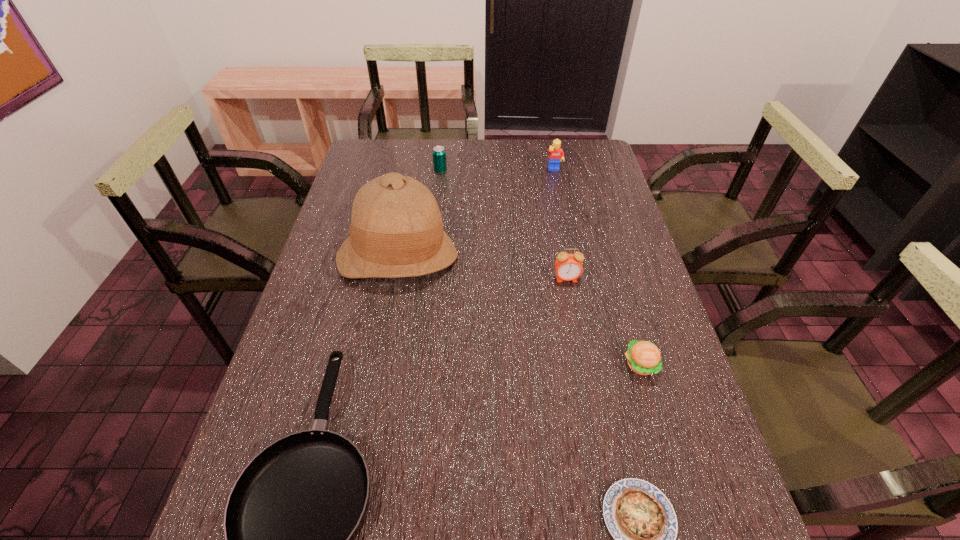
You are a GUI agent. You are given a task and a screenshot of the screen. Output one action in this format:
    pyautogui.click(x=<x>, y=<y>)
    Task: Click on the tallest object
    
    Given the screenshot: What is the action you would take?
    pyautogui.click(x=396, y=230)

The height and width of the screenshot is (540, 960). I want to click on Lego, so click(x=556, y=154).

This screenshot has height=540, width=960. Find the location of `alarm clock`. alarm clock is located at coordinates (568, 267).

Identify the location of beer can. The height and width of the screenshot is (540, 960). tap(439, 154).

Locate an element on the screen. The image size is (960, 540). the fifth tallest object is located at coordinates (643, 357).

This screenshot has width=960, height=540. I want to click on vacant space situated 0.240m on the front-facing side of the hat, so click(376, 369).

Locate an element on the screen. vacant space located 0.330m on the face of the Lego is located at coordinates (568, 234).

Where is `free point located on the face of the alarm clock`? This screenshot has height=540, width=960. free point located on the face of the alarm clock is located at coordinates (570, 300).

You are a GUI agent. You are given a task and a screenshot of the screen. Output one action in this format:
    pyautogui.click(x=<x>, y=<y>)
    Task: Click on the vacant space located 0.150m on the left of the fourth shortest object
    The height and width of the screenshot is (540, 960).
    Given the screenshot: What is the action you would take?
    pyautogui.click(x=393, y=171)

Locate an element on the screen. This screenshot has height=540, width=960. free location located 0.350m on the back of the hamburger is located at coordinates (607, 249).